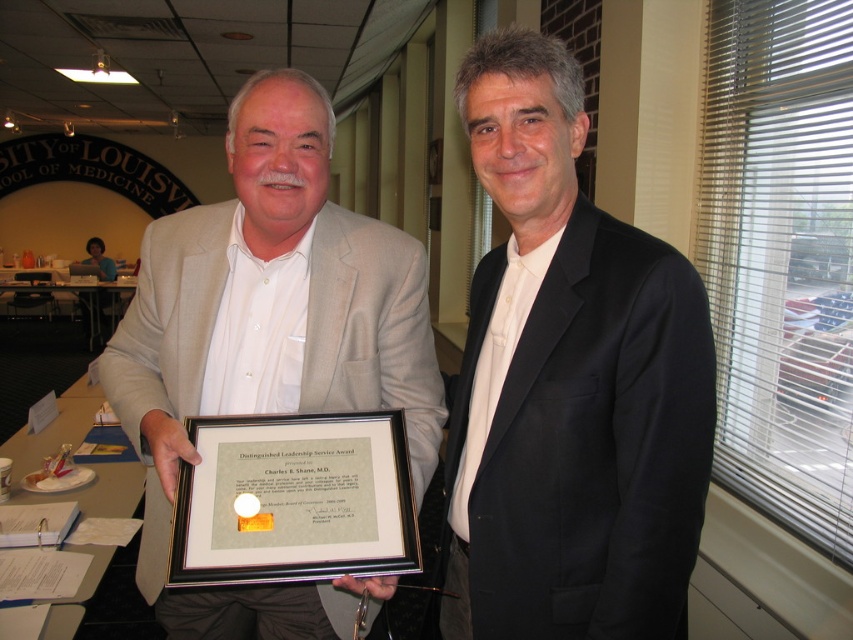
Question: Can you confirm if black satin suit at center is positioned to the left of matte beige suit at center?

Choices:
 (A) yes
 (B) no

Answer: (B)

Question: Does black satin suit at center appear on the left side of matte beige suit at center?

Choices:
 (A) yes
 (B) no

Answer: (B)

Question: Can you confirm if black satin suit at center is positioned below matte beige suit at center?

Choices:
 (A) no
 (B) yes

Answer: (A)

Question: Which point is closer to the camera?

Choices:
 (A) (231, 632)
 (B) (514, 257)

Answer: (B)